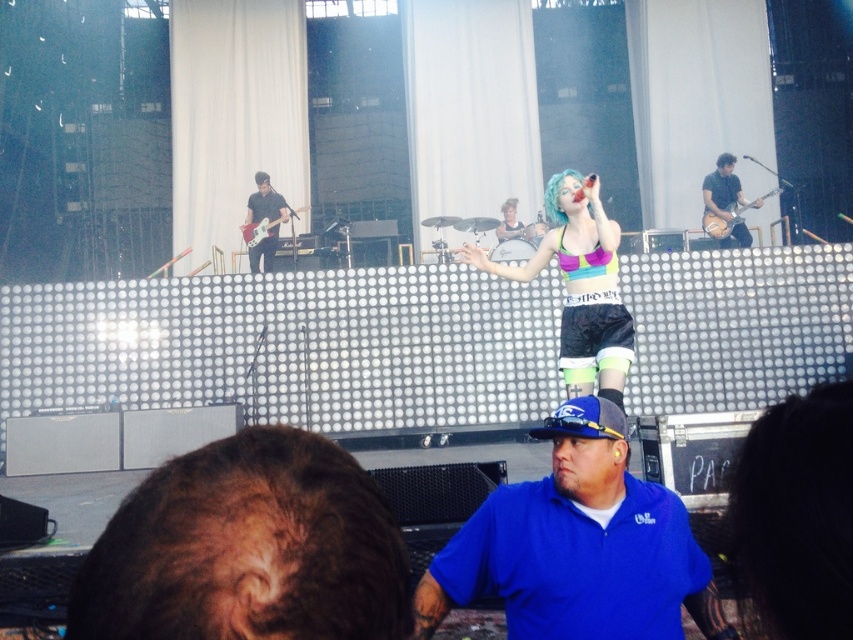
You are standing at the camera position in the concert venue. There is a point at coordinate (732, 182) in the image. If you want to walk directly to that point, how far will you have to walk in feet?

You will have to walk 37.69 feet to reach the point at coordinate (732, 182) from the camera position.

You are a photographer at the concert and want to capture both the shiny black guitar at upper right and the light brown wood electric guitar at upper right in a single photo. Which guitar should you focus on first to ensure both are in frame?

The shiny black guitar at upper right is above the light brown wood electric guitar at upper right, so focusing on the higher positioned shiny black guitar at upper right first will help ensure both guitars are within the frame.

You are a photographer at the concert and need to capture a photo that includes both the shiny black guitar at upper right and the light brown wood electric guitar at upper right. From the audience perspective, which guitar should you position on the left side of the photo?

The shiny black guitar at upper right should be positioned on the left side of the photo because it is located to the left of the light brown wood electric guitar at upper right in the scene.